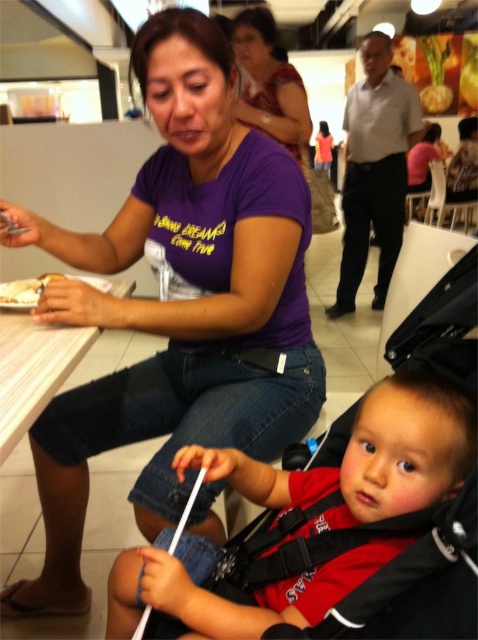
Question: Which of the following is the closest to the observer?

Choices:
 (A) click(54, 449)
 (B) click(261, 13)
 (C) click(24, 342)

Answer: (C)

Question: Is white wood table at lower left smaller than matte purple shirt at upper center?

Choices:
 (A) no
 (B) yes

Answer: (B)

Question: Which object is positioned farthest from the purple cotton shirt at center?

Choices:
 (A) matte purple shirt at upper center
 (B) white matte plate at lower left
 (C) white wood table at lower left

Answer: (A)

Question: Can you confirm if purple cotton shirt at center is positioned below matte purple shirt at upper center?

Choices:
 (A) yes
 (B) no

Answer: (A)

Question: Does purple cotton shirt at center lie behind white wood table at lower left?

Choices:
 (A) no
 (B) yes

Answer: (B)

Question: Which of the following is the farthest from the observer?

Choices:
 (A) (329, 561)
 (B) (2, 296)

Answer: (B)